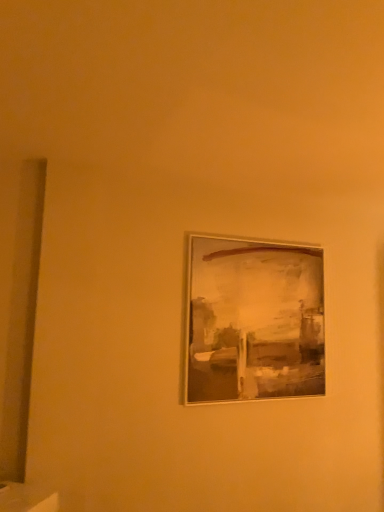
Describe the element at coordinates (253, 320) in the screenshot. I see `matte white picture frame at center` at that location.

What is the approximate height of matte white picture frame at center?

The height of matte white picture frame at center is 38.32 inches.

Locate an element on the screen. This screenshot has width=384, height=512. matte white picture frame at center is located at coordinates (253, 320).

Locate an element on the screen. The image size is (384, 512). matte white picture frame at center is located at coordinates (253, 320).